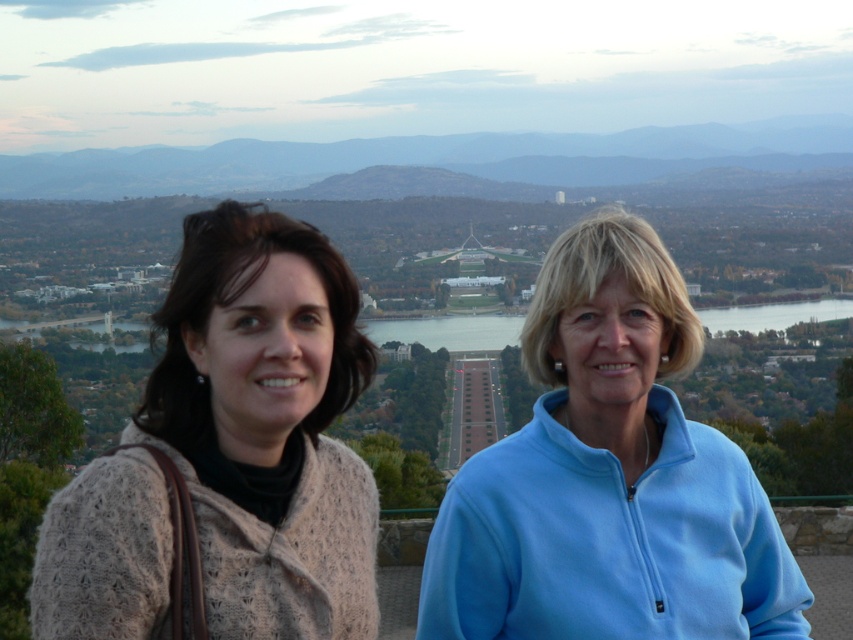
Between point (161, 148) and point (746, 314), which one is positioned in front?

Point (746, 314) is more forward.

Which is more to the right, blue hazy mountain at upper center or blue glassy water at center?

blue glassy water at center

Image resolution: width=853 pixels, height=640 pixels. Identify the location of blue hazy mountain at upper center. (431, 157).

Is knitted beige sweater at left shorter than blue glassy water at center?

Yes, knitted beige sweater at left is shorter than blue glassy water at center.

Is knitted beige sweater at left wider than blue glassy water at center?

No, knitted beige sweater at left is not wider than blue glassy water at center.

Between point (260, 243) and point (426, 346), which one is positioned in front?

Point (260, 243) is more forward.

At what (x,y) coordinates should I click in order to perform the action: click on knitted beige sweater at left. Please return your answer as a coordinate pair (x, y). Looking at the image, I should click on (265, 426).

Is knitted beige sweater at left positioned at the back of blue fleece jacket at center?

That is False.

Between point (260, 417) and point (606, 604), which one is positioned behind?

The point (606, 604) is more distant.

Locate an element on the screen. knitted beige sweater at left is located at coordinates (265, 426).